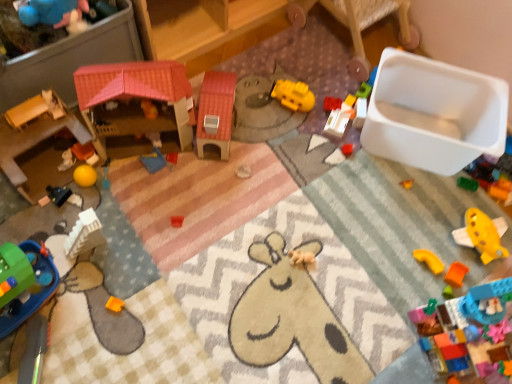
This screenshot has height=384, width=512. I want to click on vacant space that's between bright red plastic blocks at center, which ranks as the seventh toy in right-to-left order, and green plastic toy at lower left, acting as the second toy starting from the left, so click(x=207, y=186).